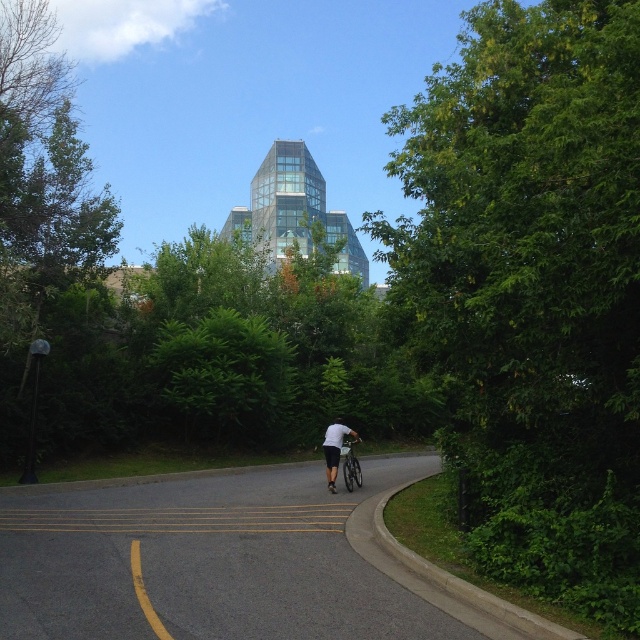
Question: Which object appears closest to the camera in this image?

Choices:
 (A) white matte shirt at center
 (B) green leafy tree at center

Answer: (B)

Question: Among these objects, which one is nearest to the camera?

Choices:
 (A) white matte shirt at center
 (B) green leafy tree at center

Answer: (B)

Question: Does green leafy tree at center appear over black asphalt bike lane at center?

Choices:
 (A) yes
 (B) no

Answer: (A)

Question: Is green leafy tree at center positioned before white matte shirt at center?

Choices:
 (A) no
 (B) yes

Answer: (B)

Question: Which of the following is the closest to the observer?

Choices:
 (A) (326, 428)
 (B) (481, 621)

Answer: (B)

Question: Does green leafy tree at center have a smaller size compared to white matte shirt at center?

Choices:
 (A) no
 (B) yes

Answer: (A)